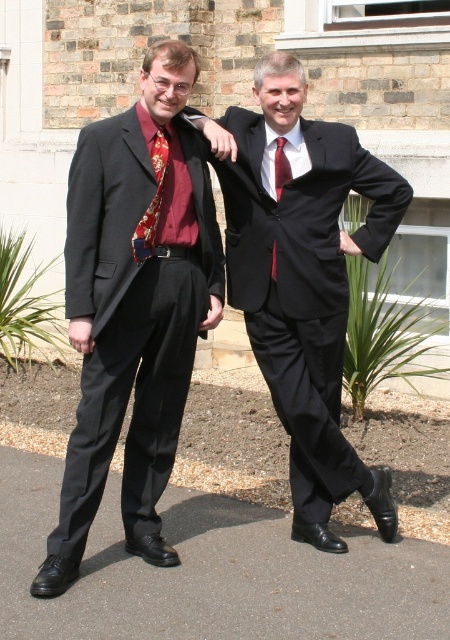
Is matte black suit at left further to the viewer compared to silky red tie at center?

No, it is in front of silky red tie at center.

What do you see at coordinates (134, 310) in the screenshot?
I see `matte black suit at left` at bounding box center [134, 310].

This screenshot has height=640, width=450. Identify the location of matte black suit at left. (134, 310).

Which is above, matte black suit at left or shiny silk tie at center?

A: shiny silk tie at center is higher up.

Does matte black suit at left have a larger size compared to shiny silk tie at center?

Yes, matte black suit at left is bigger than shiny silk tie at center.

In the scene shown: Measure the distance between matte black suit at left and camera.

A distance of 10.12 feet exists between matte black suit at left and camera.

At what (x,y) coordinates should I click in order to perform the action: click on matte black suit at left. Please return your answer as a coordinate pair (x, y). This screenshot has height=640, width=450. Looking at the image, I should click on (134, 310).

Is matte black suit at left positioned at the back of matte black suit at center?

No.

Can you confirm if matte black suit at left is positioned to the right of matte black suit at center?

Incorrect, matte black suit at left is not on the right side of matte black suit at center.

Which is behind, point (121, 262) or point (311, 269)?

Positioned behind is point (311, 269).

At what (x,y) coordinates should I click in order to perform the action: click on matte black suit at left. Please return your answer as a coordinate pair (x, y). Image resolution: width=450 pixels, height=640 pixels. Looking at the image, I should click on (134, 310).